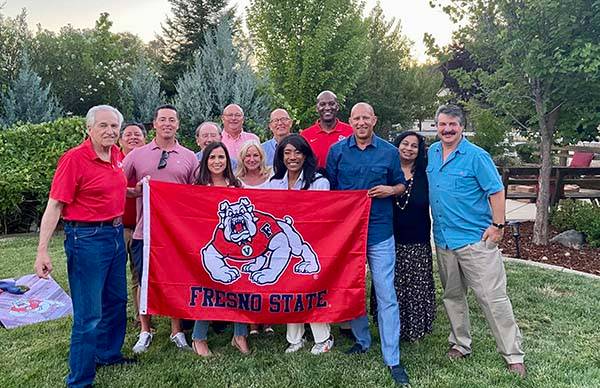
Where is `bench`? bench is located at coordinates (555, 185).